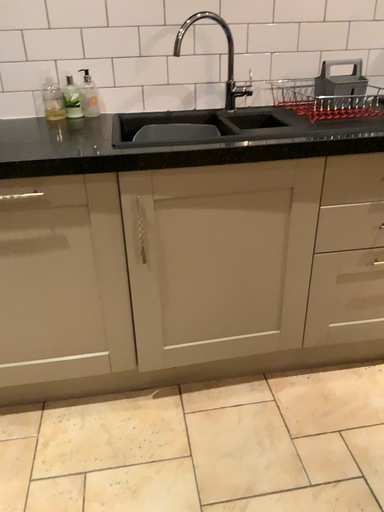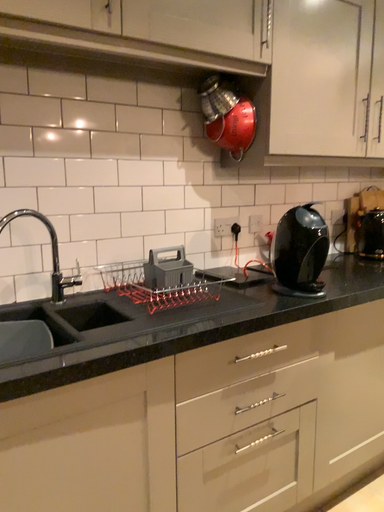
Question: How did the camera likely rotate when shooting the video?

Choices:
 (A) rotated upward
 (B) rotated downward

Answer: (A)